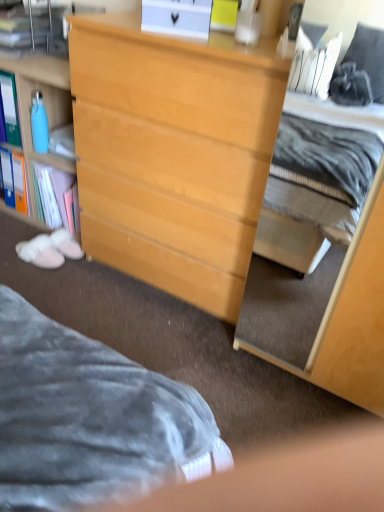
Question: From a real-world perspective, is matte blue bottle at left beneath light wood dresser at center?

Choices:
 (A) yes
 (B) no

Answer: (B)

Question: Is there a large distance between matte blue bottle at left and light wood dresser at center?

Choices:
 (A) yes
 (B) no

Answer: (B)

Question: Is matte blue bottle at left outside light wood dresser at center?

Choices:
 (A) yes
 (B) no

Answer: (A)

Question: Is matte blue bottle at left smaller than light wood dresser at center?

Choices:
 (A) yes
 (B) no

Answer: (A)

Question: Is the position of matte blue bottle at left more distant than that of light wood dresser at center?

Choices:
 (A) no
 (B) yes

Answer: (B)

Question: From a real-world perspective, is matte blue bottle at left on light wood dresser at center?

Choices:
 (A) yes
 (B) no

Answer: (A)

Question: Does light wood dresser at center, the 1th cabinetry in the right-to-left sequence, turn towards light wood cabinet at center, which ranks as the first cabinetry in left-to-right order?

Choices:
 (A) yes
 (B) no

Answer: (B)

Question: From a real-world perspective, is light wood dresser at center, the second cabinetry from the left, physically above light wood cabinet at center, which ranks as the first cabinetry in left-to-right order?

Choices:
 (A) yes
 (B) no

Answer: (A)

Question: Is light wood dresser at center, the second cabinetry from the left, positioned with its back to light wood cabinet at center, the second cabinetry positioned from the right?

Choices:
 (A) yes
 (B) no

Answer: (B)

Question: From a real-world perspective, is light wood dresser at center, the second cabinetry from the left, located beneath light wood cabinet at center, which ranks as the first cabinetry in left-to-right order?

Choices:
 (A) yes
 (B) no

Answer: (B)

Question: Is there a large distance between light wood dresser at center, the 1th cabinetry in the right-to-left sequence, and light wood cabinet at center, the second cabinetry positioned from the right?

Choices:
 (A) no
 (B) yes

Answer: (B)

Question: Is light wood dresser at center, the second cabinetry from the left, at the left side of light wood cabinet at center, the second cabinetry positioned from the right?

Choices:
 (A) yes
 (B) no

Answer: (B)

Question: From the image's perspective, is light wood dresser at center, the second cabinetry from the left, below light wood dresser at center?

Choices:
 (A) yes
 (B) no

Answer: (A)